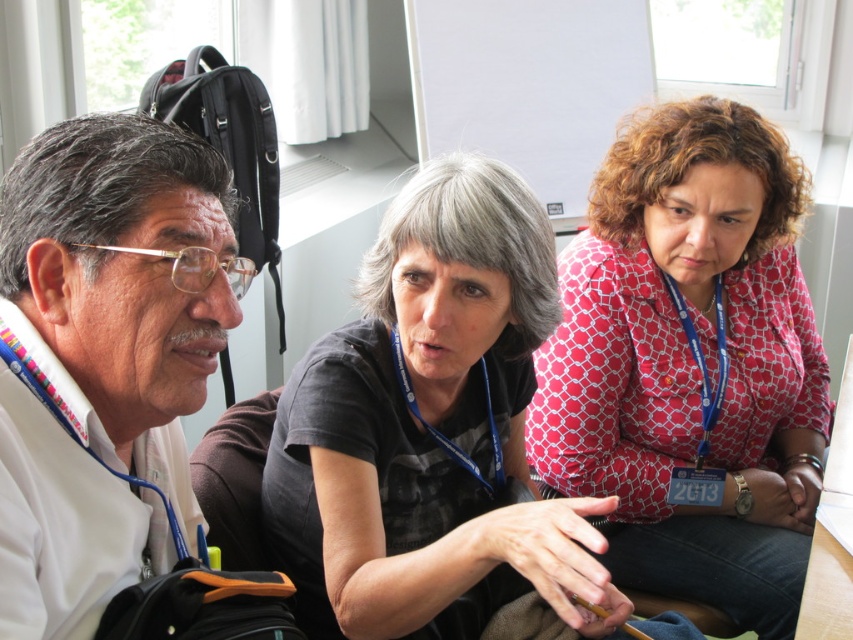
Looking at this image, you are attending a meeting and see two people in front of you. One is wearing a red dotted blouse at center and the other is wearing a white matte shirt at left. Which one is on the right side from your perspective?

The red dotted blouse at center is positioned on the right side of white matte shirt at left, so the red dotted blouse at center is on the right side from your perspective.

You are standing in the conference room and want to know how far the point at coordinates (647, 470) is from your current position. Can you determine the distance?

The point at coordinates (647, 470) is 5.11 feet away from the camera, so the distance is 5.11 feet.

You are a photographer in this scene and want to take a group photo of the red dotted blouse at center and the white matte shirt at left. To ensure both subjects are in focus, you need to know which one is taller. Can you determine which is taller?

The red dotted blouse at center is much taller than the white matte shirt at left, so you should adjust the camera angle to account for its height difference to ensure both are in focus.